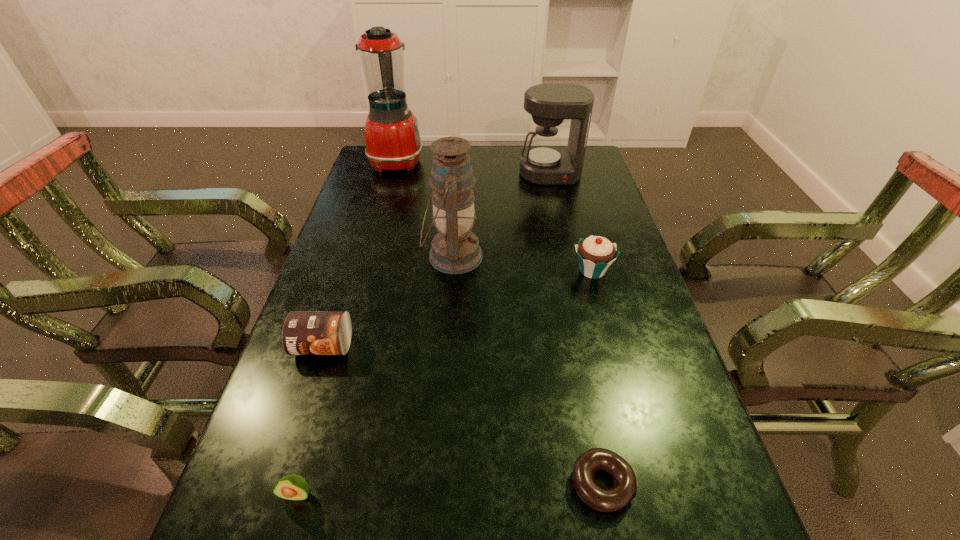
At what (x,y) coordinates should I click in order to perform the action: click on free location located 0.330m on the button side of the third tallest object. Please return your answer as a coordinate pair (x, y). The image size is (960, 540). Looking at the image, I should click on (567, 249).

Find the location of a particular element. The height and width of the screenshot is (540, 960). free point located 0.050m on the back of the fourth tallest object is located at coordinates pos(586,246).

Where is `free space located 0.050m on the front label of the can`? free space located 0.050m on the front label of the can is located at coordinates (311, 384).

Identify the location of blank space located on the left of the shortest object. The width and height of the screenshot is (960, 540). (351, 484).

Where is `food processor at the far edge`? This screenshot has width=960, height=540. food processor at the far edge is located at coordinates (392, 137).

At what (x,y) coordinates should I click in order to perform the action: click on coffee maker that is positioned at the far edge. Please return your answer as a coordinate pair (x, y). This screenshot has width=960, height=540. Looking at the image, I should click on (546, 163).

This screenshot has height=540, width=960. I want to click on food processor that is positioned at the left edge, so click(392, 137).

Where is `can that is at the left edge`? This screenshot has height=540, width=960. can that is at the left edge is located at coordinates (304, 332).

In order to click on avocado present at the left edge in this screenshot , I will do `click(291, 487)`.

You are a GUI agent. You are given a task and a screenshot of the screen. Output one action in this format:
    pyautogui.click(x=<x>, y=<y>)
    Task: Click on the coffee maker that is at the right edge
    
    Given the screenshot: What is the action you would take?
    pyautogui.click(x=546, y=163)